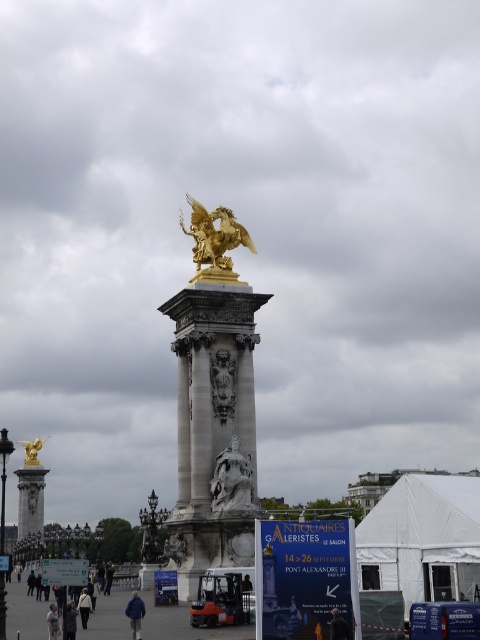
Question: Does dark blue fabric at lower center appear under light brown leather jacket at lower left?

Choices:
 (A) no
 (B) yes

Answer: (A)

Question: Which object is the closest to the dark blue jeans at lower left?

Choices:
 (A) gold/gilded statue at center
 (B) dark gray jacket at lower center
 (C) carved stone statue at center

Answer: (C)

Question: Which object is the closest to the gold/gilded statue at center?

Choices:
 (A) white fabric person at lower center
 (B) dark gray jacket at lower center
 (C) gold metallic statue at left

Answer: (A)

Question: Does gold/gilded statue at center lie behind blue fabric jacket at lower center?

Choices:
 (A) no
 (B) yes

Answer: (B)

Question: Which of the following is the closest to the observer?

Choices:
 (A) (60, 634)
 (B) (25, 449)

Answer: (A)

Question: Does gold/gilded statue at center appear over dark blue jacket at center?

Choices:
 (A) no
 (B) yes

Answer: (B)